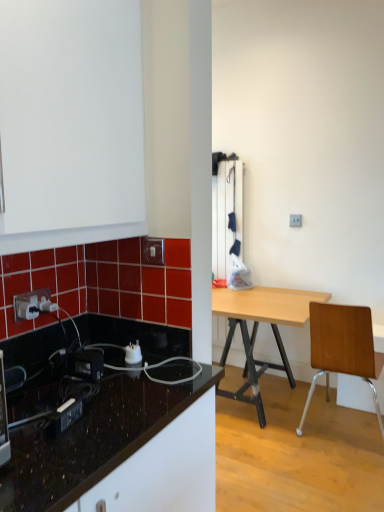
The image size is (384, 512). I want to click on white plastic power plugs and sockets at lower left, so click(133, 353).

Find the location of a particular element. white glossy power outlet at upper left is located at coordinates (32, 304).

Find the location of `brown wooden chair at right`. brown wooden chair at right is located at coordinates (343, 348).

Would you say brown wooden chair at right is inside or outside white glossy electric outlet at upper center?

brown wooden chair at right lies outside white glossy electric outlet at upper center.

This screenshot has height=512, width=384. I want to click on electric outlet above the brown wooden chair at right (from a real-world perspective), so click(152, 251).

Is brown wooden chair at right facing towards white glossy electric outlet at upper center?

No, brown wooden chair at right is not turned towards white glossy electric outlet at upper center.

Which point is more forward, [360,329] or [143,253]?

The point [143,253] is more forward.

Is white glossy power outlet at upper left taller or shorter than brown wooden chair at right?

Considering their sizes, white glossy power outlet at upper left has less height than brown wooden chair at right.

In the image, is white glossy power outlet at upper left positioned in front of or behind brown wooden chair at right?

In the image, white glossy power outlet at upper left appears in front of brown wooden chair at right.

In the scene shown: Is white glossy power outlet at upper left bigger or smaller than brown wooden chair at right?

In the image, white glossy power outlet at upper left appears to be smaller than brown wooden chair at right.

Is white glossy power outlet at upper left next to white glossy electric outlet at upper center?

white glossy power outlet at upper left and white glossy electric outlet at upper center are clearly separated.

Is point (23, 302) positioned after point (152, 240)?

No, (23, 302) is in front of (152, 240).

From the image's perspective, is white glossy power outlet at upper left above white glossy electric outlet at upper center?

No, from the image's perspective, white glossy power outlet at upper left is not over white glossy electric outlet at upper center.

Can you confirm if white glossy power outlet at upper left is wider than white glossy electric outlet at upper center?

Incorrect, the width of white glossy power outlet at upper left does not surpass that of white glossy electric outlet at upper center.

Would you say black glossy countertop at lower left is part of brown wooden chair at right's contents?

No, black glossy countertop at lower left is not surrounded by brown wooden chair at right.

I want to click on chair to the right of black glossy countertop at lower left, so click(343, 348).

Between brown wooden chair at right and black glossy countertop at lower left, which one has larger size?

black glossy countertop at lower left.

Considering their positions, is brown wooden chair at right located in front of or behind black glossy countertop at lower left?

Visually, brown wooden chair at right is located behind black glossy countertop at lower left.

Would you consider brown wooden chair at right to be distant from white plastic power plugs and sockets at lower left?

Absolutely, brown wooden chair at right is distant from white plastic power plugs and sockets at lower left.

Is brown wooden chair at right positioned beyond the bounds of white plastic power plugs and sockets at lower left?

Yes, brown wooden chair at right is outside of white plastic power plugs and sockets at lower left.

Between point (340, 320) and point (133, 358), which one is positioned behind?

Point (340, 320)

Considering the sizes of objects brown wooden chair at right and white plastic power plugs and sockets at lower left in the image provided, who is smaller, brown wooden chair at right or white plastic power plugs and sockets at lower left?

Smaller between the two is white plastic power plugs and sockets at lower left.

Would you say black glossy countertop at lower left is part of white glossy power outlet at upper left's contents?

No, black glossy countertop at lower left is not surrounded by white glossy power outlet at upper left.

The height and width of the screenshot is (512, 384). I want to click on power outlet behind the black glossy countertop at lower left, so click(32, 304).

Could you tell me if white glossy power outlet at upper left is turned towards black glossy countertop at lower left?

No, white glossy power outlet at upper left is not turned towards black glossy countertop at lower left.

How different are the orientations of white glossy power outlet at upper left and black glossy countertop at lower left in degrees?

The angular difference between white glossy power outlet at upper left and black glossy countertop at lower left is 178 degrees.

Considering the relative positions of brown wooden chair at right and white glossy power outlet at upper left in the image provided, is brown wooden chair at right in front of white glossy power outlet at upper left?

No, it is not.

Would you say brown wooden chair at right is outside white glossy power outlet at upper left?

Indeed, brown wooden chair at right is completely outside white glossy power outlet at upper left.

Is brown wooden chair at right far from white glossy power outlet at upper left?

Yes, brown wooden chair at right is far from white glossy power outlet at upper left.

Looking at this image, who is shorter, brown wooden chair at right or white glossy power outlet at upper left?

Standing shorter between the two is white glossy power outlet at upper left.

The width and height of the screenshot is (384, 512). Find the location of `chair located on the right of white glossy electric outlet at upper center`. chair located on the right of white glossy electric outlet at upper center is located at coordinates (343, 348).

In the image, there is a white glossy power outlet at upper left. What are the coordinates of `chair below it (from the image's perspective)` in the screenshot? It's located at (343, 348).

Based on their spatial positions, is white glossy electric outlet at upper center or white plastic power plugs and sockets at lower left further from black glossy countertop at lower left?

A: The object further to black glossy countertop at lower left is white glossy electric outlet at upper center.

From the image, which object appears to be farther from black glossy countertop at lower left, white glossy electric outlet at upper center or brown wooden chair at right?

The object further to black glossy countertop at lower left is brown wooden chair at right.

Based on their spatial positions, is white glossy electric outlet at upper center or white glossy power outlet at upper left closer to brown wooden chair at right?

white glossy electric outlet at upper center is closer to brown wooden chair at right.

Consider the image. Looking at the image, which one is located further to white glossy electric outlet at upper center, white glossy power outlet at upper left or black glossy countertop at lower left?

black glossy countertop at lower left is further to white glossy electric outlet at upper center.

From the image, which object appears to be nearer to white glossy electric outlet at upper center, white plastic power plugs and sockets at lower left or black glossy countertop at lower left?

Based on the image, white plastic power plugs and sockets at lower left appears to be nearer to white glossy electric outlet at upper center.

Which object lies nearer to the anchor point white glossy electric outlet at upper center, brown wooden chair at right or white plastic power plugs and sockets at lower left?

Based on the image, white plastic power plugs and sockets at lower left appears to be nearer to white glossy electric outlet at upper center.

Which object lies further to the anchor point white glossy power outlet at upper left, white plastic power plugs and sockets at lower left or brown wooden chair at right?

Based on the image, brown wooden chair at right appears to be further to white glossy power outlet at upper left.

When comparing their distances from white glossy electric outlet at upper center, does white plastic power plugs and sockets at lower left or white glossy power outlet at upper left seem further?

Among the two, white glossy power outlet at upper left is located further to white glossy electric outlet at upper center.

Find the location of a particular element. This screenshot has width=384, height=512. power plugs and sockets between white glossy power outlet at upper left and white glossy electric outlet at upper center is located at coordinates (133, 353).

Locate an element on the screen. The width and height of the screenshot is (384, 512). electric outlet between white plastic power plugs and sockets at lower left and brown wooden chair at right is located at coordinates (152, 251).

Where is `power plugs and sockets between white glossy power outlet at upper left and brown wooden chair at right in the horizontal direction`? power plugs and sockets between white glossy power outlet at upper left and brown wooden chair at right in the horizontal direction is located at coordinates (133, 353).

Where is `electric outlet located between white glossy power outlet at upper left and brown wooden chair at right in the left-right direction`? The image size is (384, 512). electric outlet located between white glossy power outlet at upper left and brown wooden chair at right in the left-right direction is located at coordinates (152, 251).